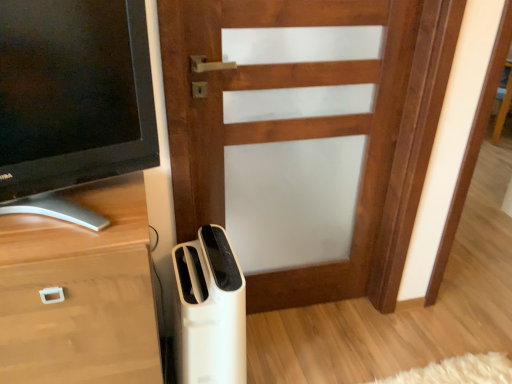
Question: Is matte black tv at left shorter than white plastic air purifier at lower center?

Choices:
 (A) no
 (B) yes

Answer: (B)

Question: Is matte black tv at left to the left of white plastic air purifier at lower center from the viewer's perspective?

Choices:
 (A) no
 (B) yes

Answer: (B)

Question: From the image's perspective, is matte black tv at left on white plastic air purifier at lower center?

Choices:
 (A) yes
 (B) no

Answer: (A)

Question: Is matte black tv at left directly adjacent to white plastic air purifier at lower center?

Choices:
 (A) no
 (B) yes

Answer: (A)

Question: Could you tell me if matte black tv at left is turned towards white plastic air purifier at lower center?

Choices:
 (A) yes
 (B) no

Answer: (B)

Question: From the image's perspective, would you say matte black tv at left is shown under white plastic air purifier at lower center?

Choices:
 (A) yes
 (B) no

Answer: (B)

Question: Considering the relative sizes of matte black tv at left and wooden door at center in the image provided, is matte black tv at left bigger than wooden door at center?

Choices:
 (A) no
 (B) yes

Answer: (A)

Question: Does matte black tv at left have a smaller size compared to wooden door at center?

Choices:
 (A) yes
 (B) no

Answer: (A)

Question: Considering the relative sizes of matte black tv at left and wooden door at center in the image provided, is matte black tv at left thinner than wooden door at center?

Choices:
 (A) no
 (B) yes

Answer: (B)

Question: From the image's perspective, is matte black tv at left beneath wooden door at center?

Choices:
 (A) no
 (B) yes

Answer: (A)

Question: Considering the relative sizes of matte black tv at left and wooden door at center in the image provided, is matte black tv at left shorter than wooden door at center?

Choices:
 (A) yes
 (B) no

Answer: (A)

Question: Is matte black tv at left wider than wooden door at center?

Choices:
 (A) no
 (B) yes

Answer: (A)

Question: Is there a large distance between white plastic air purifier at lower center and wooden chest of drawers at lower left?

Choices:
 (A) no
 (B) yes

Answer: (A)